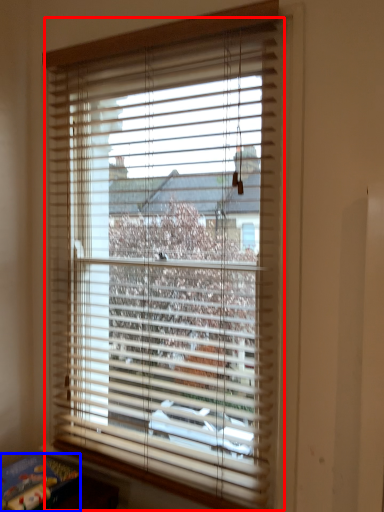
Question: Among these objects, which one is farthest to the camera, window blind (highlighted by a red box) or paperback book (highlighted by a blue box)?

Choices:
 (A) window blind
 (B) paperback book

Answer: (B)